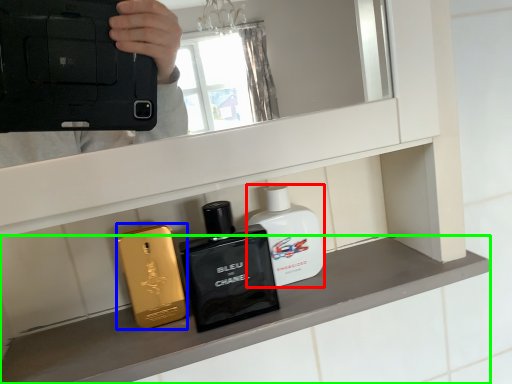
Question: Based on their relative distances, which object is farther from perfume (highlighted by a red box)? Choose from perfume (highlighted by a blue box) and mantle (highlighted by a green box).

Choices:
 (A) perfume
 (B) mantle

Answer: (A)